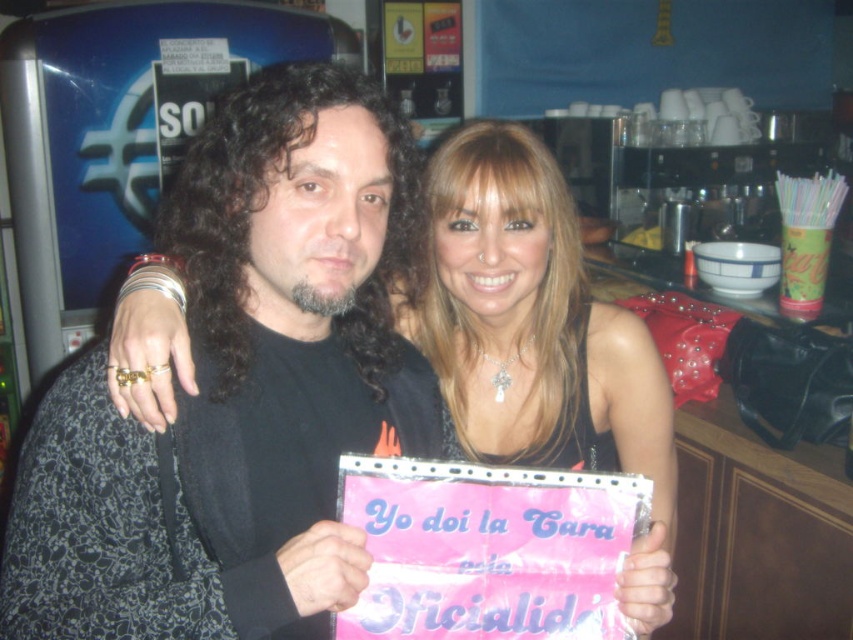
Question: Does black matte shirt at center have a greater width compared to shiny black dress at center?

Choices:
 (A) no
 (B) yes

Answer: (A)

Question: Observing the image, what is the correct spatial positioning of black matte shirt at center in reference to shiny black dress at center?

Choices:
 (A) below
 (B) above

Answer: (B)

Question: Among these points, which one is farthest from the camera?

Choices:
 (A) (294, 364)
 (B) (492, 284)

Answer: (B)

Question: Does black matte shirt at center have a smaller size compared to shiny black dress at center?

Choices:
 (A) yes
 (B) no

Answer: (A)